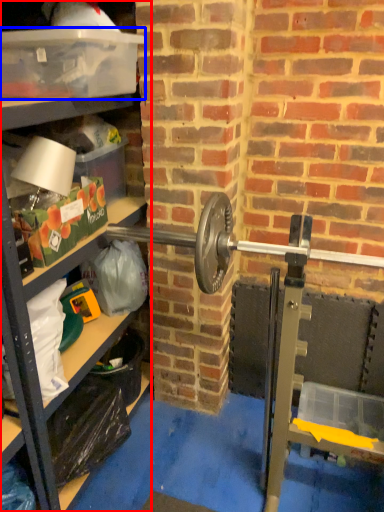
Question: Which point is closer to the camera, shelf (highlighted by a red box) or box (highlighted by a blue box)?

Choices:
 (A) shelf
 (B) box

Answer: (A)